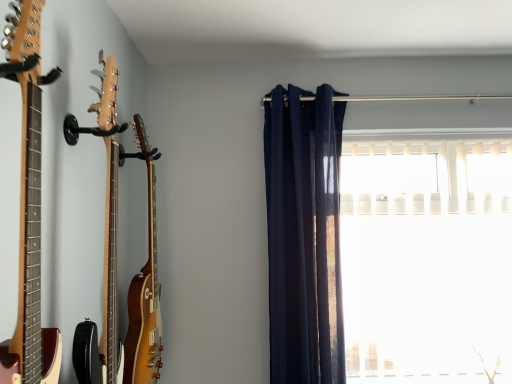
In order to face light brown wood guitar at left, which ranks as the second guitar in back-to-front order, should I rotate leftwards or rightwards?

You should look left and rotate roughly 19.700 degrees.

Describe the element at coordinates (29, 206) in the screenshot. I see `wooden acoustic guitar at left, positioned as the third guitar in back-to-front order` at that location.

This screenshot has width=512, height=384. Identify the location of light brown wood guitar at left, the second guitar when ordered from front to back. (105, 241).

This screenshot has height=384, width=512. I want to click on curtain on the right of glossy wood guitar at left, which is counted as the 1th guitar, starting from the back, so click(x=304, y=235).

Is point (137, 118) less distant than point (322, 375)?

Yes, point (137, 118) is in front of point (322, 375).

In the scene shown: Is navy blue fabric curtain at center at the back of glossy wood guitar at left, which is counted as the 1th guitar, starting from the back?

No.

Based on the photo, who is shorter, glossy wood guitar at left, positioned as the third guitar in front-to-back order, or navy blue fabric curtain at center?

glossy wood guitar at left, positioned as the third guitar in front-to-back order, is shorter.

From a real-world perspective, is wooden acoustic guitar at left, which appears as the 1th guitar when viewed from the front, on white plastic blinds at right?

Yes, from a real-world perspective, wooden acoustic guitar at left, which appears as the 1th guitar when viewed from the front, is over white plastic blinds at right

Which object is more forward, wooden acoustic guitar at left, positioned as the third guitar in back-to-front order, or white plastic blinds at right?

wooden acoustic guitar at left, positioned as the third guitar in back-to-front order, is more forward.

Is wooden acoustic guitar at left, positioned as the third guitar in back-to-front order, turned away from white plastic blinds at right?

No, wooden acoustic guitar at left, positioned as the third guitar in back-to-front order, is not facing away from white plastic blinds at right.

Which of these two, wooden acoustic guitar at left, positioned as the third guitar in back-to-front order, or white plastic blinds at right, is wider?

Wider between the two is white plastic blinds at right.

Where is `the 1st guitar above when counting from the navy blue fabric curtain at center (from the image's perspective)`? The image size is (512, 384). the 1st guitar above when counting from the navy blue fabric curtain at center (from the image's perspective) is located at coordinates (105, 241).

Is light brown wood guitar at left, the second guitar when ordered from front to back, taller than navy blue fabric curtain at center?

Incorrect, the height of light brown wood guitar at left, the second guitar when ordered from front to back, is not larger of that of navy blue fabric curtain at center.

Is light brown wood guitar at left, which ranks as the second guitar in back-to-front order, next to navy blue fabric curtain at center and touching it?

There is a gap between light brown wood guitar at left, which ranks as the second guitar in back-to-front order, and navy blue fabric curtain at center.

Which of these two, light brown wood guitar at left, the second guitar when ordered from front to back, or navy blue fabric curtain at center, is wider?

navy blue fabric curtain at center.

This screenshot has width=512, height=384. What are the coordinates of `guitar that is the 2nd object to the left of the navy blue fabric curtain at center, starting at the anchor` in the screenshot? It's located at (29, 206).

Considering the positions of point (310, 323) and point (42, 328), is point (310, 323) closer or farther from the camera than point (42, 328)?

Point (310, 323) is farther from the camera than point (42, 328).

Is navy blue fabric curtain at center at the left side of wooden acoustic guitar at left, positioned as the third guitar in back-to-front order?

In fact, navy blue fabric curtain at center is to the right of wooden acoustic guitar at left, positioned as the third guitar in back-to-front order.

Which is nearer, (418, 237) or (96, 331)?

The point (96, 331) is closer to the camera.

From the image's perspective, is white plastic blinds at right located above or below light brown wood guitar at left, the second guitar when ordered from front to back?

Based on their image positions, white plastic blinds at right is located beneath light brown wood guitar at left, the second guitar when ordered from front to back.

Considering the relative positions of white plastic blinds at right and light brown wood guitar at left, which ranks as the second guitar in back-to-front order, in the image provided, is white plastic blinds at right to the right of light brown wood guitar at left, which ranks as the second guitar in back-to-front order, from the viewer's perspective?

Indeed, white plastic blinds at right is positioned on the right side of light brown wood guitar at left, which ranks as the second guitar in back-to-front order.

Is navy blue fabric curtain at center far away from glossy wood guitar at left, positioned as the third guitar in front-to-back order?

No, navy blue fabric curtain at center is in close proximity to glossy wood guitar at left, positioned as the third guitar in front-to-back order.

From the image's perspective, between navy blue fabric curtain at center and glossy wood guitar at left, positioned as the third guitar in front-to-back order, which one is located above?

navy blue fabric curtain at center, from the image's perspective.

Who is smaller, navy blue fabric curtain at center or glossy wood guitar at left, positioned as the third guitar in front-to-back order?

With smaller size is glossy wood guitar at left, positioned as the third guitar in front-to-back order.

Does navy blue fabric curtain at center appear on the right side of glossy wood guitar at left, positioned as the third guitar in front-to-back order?

Correct, you'll find navy blue fabric curtain at center to the right of glossy wood guitar at left, positioned as the third guitar in front-to-back order.

Who is bigger, glossy wood guitar at left, positioned as the third guitar in front-to-back order, or light brown wood guitar at left, which ranks as the second guitar in back-to-front order?

With larger size is glossy wood guitar at left, positioned as the third guitar in front-to-back order.

Between glossy wood guitar at left, positioned as the third guitar in front-to-back order, and light brown wood guitar at left, the second guitar when ordered from front to back, which one has larger width?

With larger width is light brown wood guitar at left, the second guitar when ordered from front to back.

In the scene shown: Could light brown wood guitar at left, the second guitar when ordered from front to back, be considered to be inside glossy wood guitar at left, positioned as the third guitar in front-to-back order?

No, light brown wood guitar at left, the second guitar when ordered from front to back, is not surrounded by glossy wood guitar at left, positioned as the third guitar in front-to-back order.

Is glossy wood guitar at left, which is counted as the 1th guitar, starting from the back, further to the viewer compared to light brown wood guitar at left, which ranks as the second guitar in back-to-front order?

Yes, the depth of glossy wood guitar at left, which is counted as the 1th guitar, starting from the back, is greater than that of light brown wood guitar at left, which ranks as the second guitar in back-to-front order.

This screenshot has width=512, height=384. I want to click on the 1st guitar in front of the navy blue fabric curtain at center, counting from the anchor's position, so click(144, 286).

Find the location of a particular element. The height and width of the screenshot is (384, 512). the 3rd guitar above the white plastic blinds at right (from the image's perspective) is located at coordinates (29, 206).

Considering their positions, is wooden acoustic guitar at left, which appears as the 1th guitar when viewed from the front, positioned further to navy blue fabric curtain at center than glossy wood guitar at left, which is counted as the 1th guitar, starting from the back?

wooden acoustic guitar at left, which appears as the 1th guitar when viewed from the front, is positioned further to the anchor navy blue fabric curtain at center.

Considering their positions, is light brown wood guitar at left, the second guitar when ordered from front to back, positioned closer to white plastic blinds at right than navy blue fabric curtain at center?

navy blue fabric curtain at center lies closer to white plastic blinds at right than the other object.

When comparing their distances from wooden acoustic guitar at left, positioned as the third guitar in back-to-front order, does light brown wood guitar at left, which ranks as the second guitar in back-to-front order, or navy blue fabric curtain at center seem closer?

light brown wood guitar at left, which ranks as the second guitar in back-to-front order, is positioned closer to the anchor wooden acoustic guitar at left, positioned as the third guitar in back-to-front order.

Which object lies nearer to the anchor point white plastic blinds at right, wooden acoustic guitar at left, positioned as the third guitar in back-to-front order, or navy blue fabric curtain at center?

Based on the image, navy blue fabric curtain at center appears to be nearer to white plastic blinds at right.

Looking at the image, which one is located closer to white plastic blinds at right, glossy wood guitar at left, positioned as the third guitar in front-to-back order, or navy blue fabric curtain at center?

Among the two, navy blue fabric curtain at center is located nearer to white plastic blinds at right.

Which object lies nearer to the anchor point wooden acoustic guitar at left, which appears as the 1th guitar when viewed from the front, glossy wood guitar at left, positioned as the third guitar in front-to-back order, or light brown wood guitar at left, the second guitar when ordered from front to back?

light brown wood guitar at left, the second guitar when ordered from front to back, is closer to wooden acoustic guitar at left, which appears as the 1th guitar when viewed from the front.

Which object lies further to the anchor point glossy wood guitar at left, which is counted as the 1th guitar, starting from the back, wooden acoustic guitar at left, positioned as the third guitar in back-to-front order, or white plastic blinds at right?

white plastic blinds at right is positioned further to the anchor glossy wood guitar at left, which is counted as the 1th guitar, starting from the back.

Estimate the real-world distances between objects in this image. Which object is closer to navy blue fabric curtain at center, light brown wood guitar at left, the second guitar when ordered from front to back, or glossy wood guitar at left, positioned as the third guitar in front-to-back order?

Among the two, glossy wood guitar at left, positioned as the third guitar in front-to-back order, is located nearer to navy blue fabric curtain at center.

The height and width of the screenshot is (384, 512). What are the coordinates of `curtain located between light brown wood guitar at left, the second guitar when ordered from front to back, and white plastic blinds at right in the left-right direction` in the screenshot? It's located at (304, 235).

You are a GUI agent. You are given a task and a screenshot of the screen. Output one action in this format:
    pyautogui.click(x=<x>, y=<y>)
    Task: Click on the guitar between wooden acoustic guitar at left, which appears as the 1th guitar when viewed from the front, and glossy wood guitar at left, positioned as the third guitar in front-to-back order, from front to back
    The image size is (512, 384).
    Given the screenshot: What is the action you would take?
    pyautogui.click(x=105, y=241)

The image size is (512, 384). Find the location of `curtain positioned between wooden acoustic guitar at left, positioned as the third guitar in back-to-front order, and white plastic blinds at right from near to far`. curtain positioned between wooden acoustic guitar at left, positioned as the third guitar in back-to-front order, and white plastic blinds at right from near to far is located at coordinates (304, 235).

At what (x,y) coordinates should I click in order to perform the action: click on curtain between glossy wood guitar at left, which is counted as the 1th guitar, starting from the back, and white plastic blinds at right, in the horizontal direction. Please return your answer as a coordinate pair (x, y). The image size is (512, 384). Looking at the image, I should click on (304, 235).